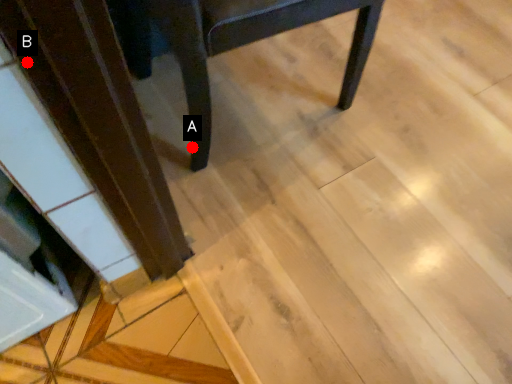
Question: Two points are circled on the image, labeled by A and B beside each circle. Which point is farther to the camera?

Choices:
 (A) A is further
 (B) B is further

Answer: (A)